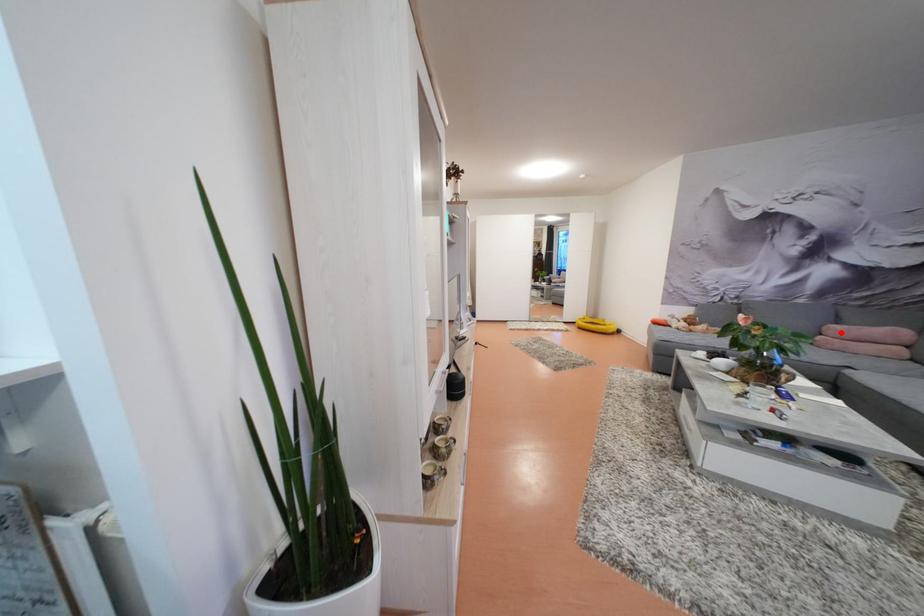
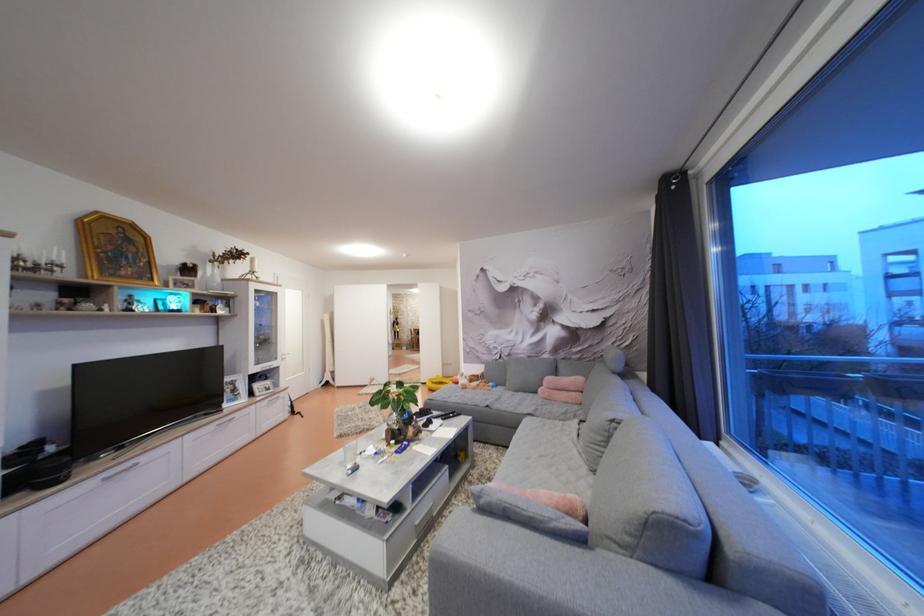
Question: I am providing you with two images of the same scene from different viewpoints. Given a red point in image1, look at the same physical point in image2. Is it:

Choices:
 (A) Closer to the viewpoint
 (B) Farther from the viewpoint

Answer: (B)